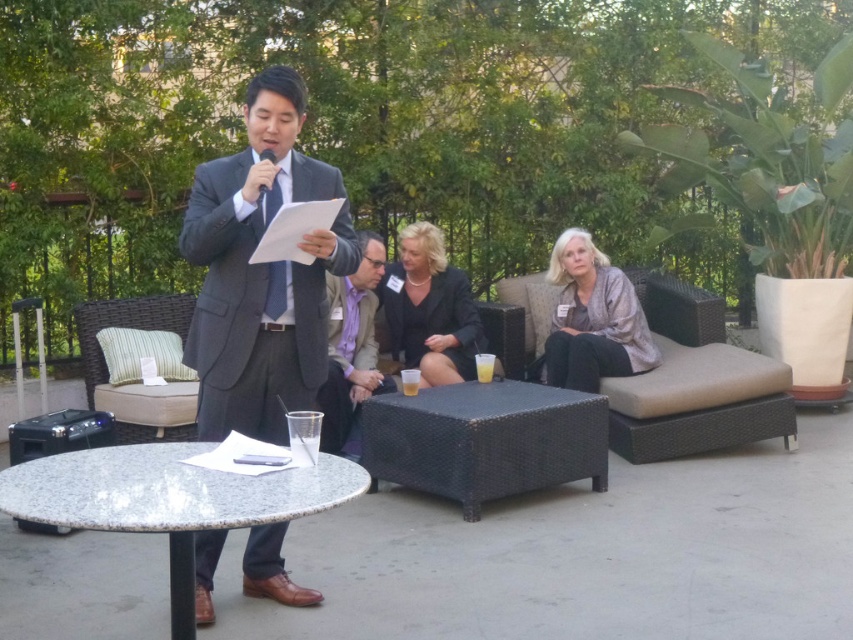
Question: Can you confirm if granite table at center is wider than gray textured blouse at center?

Choices:
 (A) no
 (B) yes

Answer: (B)

Question: Which is farther from the granite table at center?

Choices:
 (A) gray textured blouse at center
 (B) dark gray suit at center
 (C) black fabric jacket at center
 (D) black wicker coffee table at center

Answer: (A)

Question: Which object is closer to the camera taking this photo?

Choices:
 (A) gray textured blouse at center
 (B) dark gray suit at center
 (C) granite table at center

Answer: (C)

Question: Considering the relative positions of gray textured blouse at center and black fabric jacket at center in the image provided, where is gray textured blouse at center located with respect to black fabric jacket at center?

Choices:
 (A) left
 (B) right

Answer: (B)

Question: In this image, where is dark gray suit at center located relative to black wicker coffee table at center?

Choices:
 (A) below
 (B) above

Answer: (B)

Question: Estimate the real-world distances between objects in this image. Which object is closer to the dark gray suit at center?

Choices:
 (A) purple fabric suit at center
 (B) gray textured blouse at center

Answer: (A)